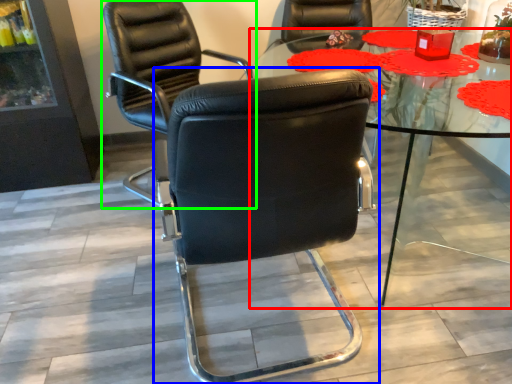
Question: Which is farther away from table (highlighted by a red box)? chair (highlighted by a blue box) or chair (highlighted by a green box)?

Choices:
 (A) chair
 (B) chair

Answer: (B)